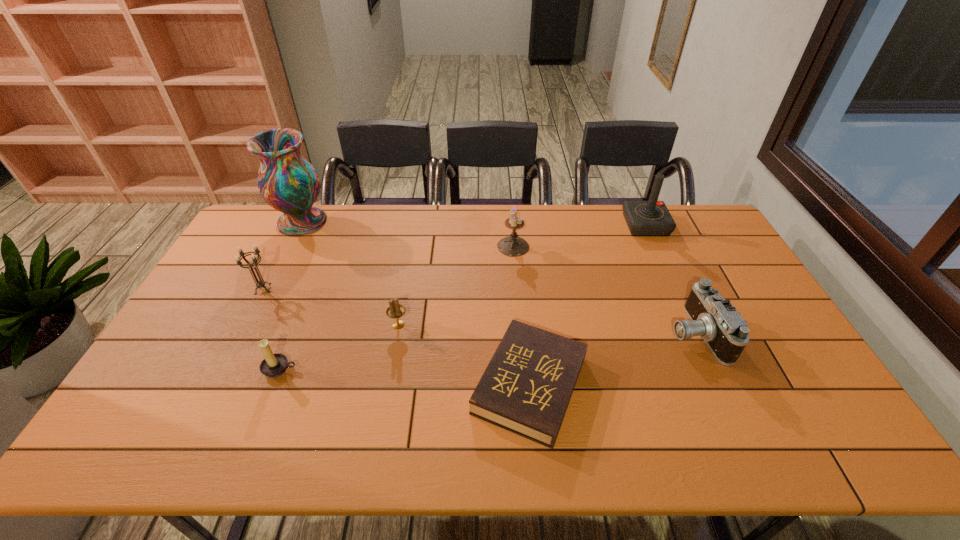
In the image, there is a desktop. Identify the location of vacant space at the left edge. (253, 245).

In order to click on vacant space at the right edge of the desktop in this screenshot , I will do `click(728, 267)`.

What are the coordinates of `free region at the far left corner of the desktop` in the screenshot? It's located at (272, 239).

Identify the location of vacant space at the near left corner. The width and height of the screenshot is (960, 540). 164,434.

In the image, there is a desktop. What are the coordinates of `free space at the near right corner` in the screenshot? It's located at (818, 422).

What are the coordinates of `vacant space that's between the hardback book and the joystick` in the screenshot? It's located at (588, 305).

Where is `free space that is in between the fifth object from right to left and the shortest object`? Image resolution: width=960 pixels, height=540 pixels. free space that is in between the fifth object from right to left and the shortest object is located at coordinates (464, 355).

I want to click on unoccupied position between the fourth farthest object and the camera, so click(479, 311).

Identify the location of free space between the tallest object and the camera. The width and height of the screenshot is (960, 540). (498, 278).

Locate an element on the screen. The width and height of the screenshot is (960, 540). free spot between the second candle holder from left to right and the fifth nearest object is located at coordinates (272, 329).